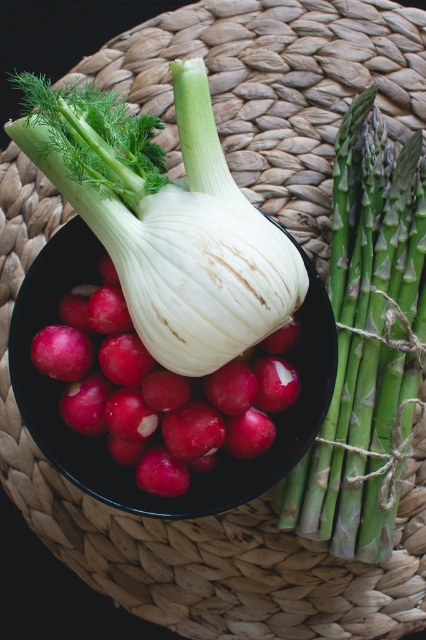
From the picture: Can you confirm if white matte fennel bulb at center is positioned below black matte bowl at center?

No, white matte fennel bulb at center is not below black matte bowl at center.

Which is below, white matte fennel bulb at center or black matte bowl at center?

black matte bowl at center is below.

Where is `white matte fennel bulb at center`? white matte fennel bulb at center is located at coordinates pyautogui.click(x=166, y=220).

Can you confirm if green textured asparagus at right is positioned to the right of black matte bowl at center?

Indeed, green textured asparagus at right is positioned on the right side of black matte bowl at center.

Image resolution: width=426 pixels, height=640 pixels. What do you see at coordinates (368, 342) in the screenshot?
I see `green textured asparagus at right` at bounding box center [368, 342].

Identify the location of green textured asparagus at right. The width and height of the screenshot is (426, 640). (368, 342).

Can you confirm if white matte fennel bulb at center is shorter than green textured asparagus at right?

Yes.

Is white matte fennel bulb at center bigger than green textured asparagus at right?

Yes.

Is point (40, 129) less distant than point (371, 291)?

Yes, it is in front of point (371, 291).

Locate an element on the screen. white matte fennel bulb at center is located at coordinates (166, 220).